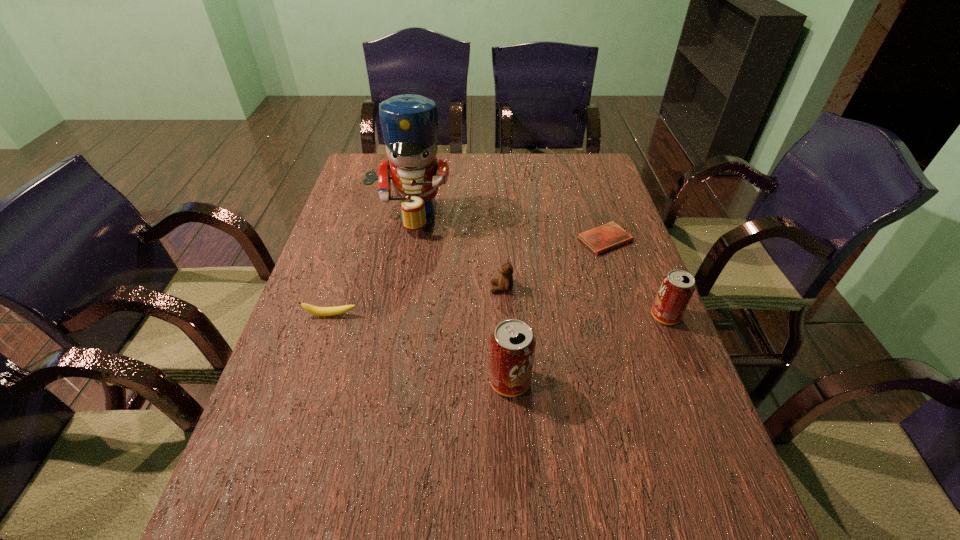
Identify the location of blank space that satisfies the following two spatial constraints: 1. on the front-facing side of the nutcracker; 2. on the right side of the nearest object. The width and height of the screenshot is (960, 540). (379, 381).

Identify the location of vacant space that satisfies the following two spatial constraints: 1. on the front side of the shorter soda can; 2. on the right side of the diary. (629, 316).

Locate an element on the screen. This screenshot has height=540, width=960. free space that satisfies the following two spatial constraints: 1. at the face of the third shortest object; 2. on the back side of the fourth shortest object is located at coordinates (503, 316).

Where is `vacant space that satisfies the following two spatial constraints: 1. on the front-facing side of the diary; 2. on the right side of the tallest object`? The width and height of the screenshot is (960, 540). vacant space that satisfies the following two spatial constraints: 1. on the front-facing side of the diary; 2. on the right side of the tallest object is located at coordinates (406, 240).